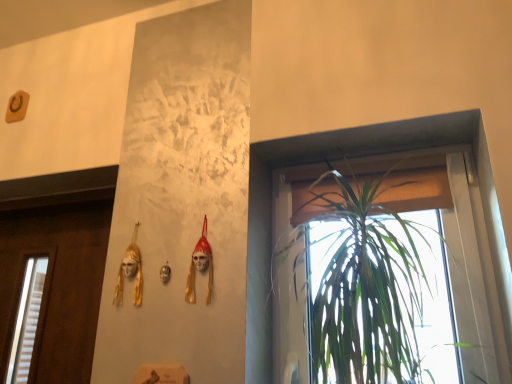
Question: Should I look upward or downward to see green leafy plant at right?

Choices:
 (A) up
 (B) down

Answer: (B)